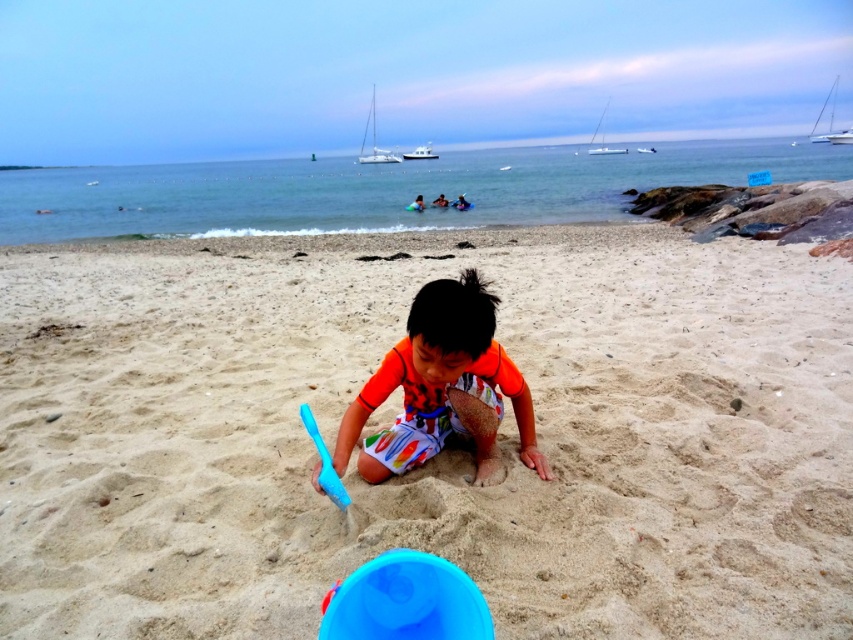
Does orange matte shirt at center have a smaller size compared to blue plastic bucket at lower center?

No, orange matte shirt at center is not smaller than blue plastic bucket at lower center.

Between orange matte shirt at center and blue plastic bucket at lower center, which one is positioned higher?

orange matte shirt at center is above.

The height and width of the screenshot is (640, 853). What do you see at coordinates (442, 388) in the screenshot?
I see `orange matte shirt at center` at bounding box center [442, 388].

I want to click on orange matte shirt at center, so click(442, 388).

Between smooth sand at center and blue plastic bucket at lower center, which one is positioned higher?

smooth sand at center

Does smooth sand at center have a smaller size compared to blue plastic bucket at lower center?

No, smooth sand at center is not smaller than blue plastic bucket at lower center.

Who is more distant from viewer, (456, 525) or (357, 624)?

Positioned behind is point (456, 525).

The image size is (853, 640). I want to click on smooth sand at center, so click(x=437, y=456).

Can you confirm if smooth sand at center is positioned to the right of orange matte shirt at center?

Yes, smooth sand at center is to the right of orange matte shirt at center.

Is point (151, 529) less distant than point (416, 326)?

No.

You are a GUI agent. You are given a task and a screenshot of the screen. Output one action in this format:
    pyautogui.click(x=<x>, y=<y>)
    Task: Click on the smooth sand at center
    
    Given the screenshot: What is the action you would take?
    pyautogui.click(x=437, y=456)